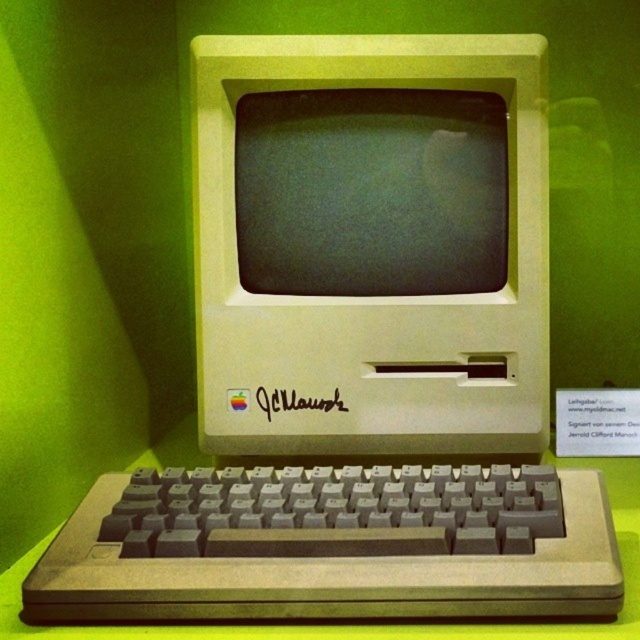
You are setting up a desk for an exhibition and need to arrange the gray plastic keyboard at lower center and the matte plastic screen at center. Which object is shorter and should be placed closer to the edge to ensure visibility?

The gray plastic keyboard at lower center is shorter than the matte plastic screen at center, so it should be placed closer to the edge to ensure visibility.

You are setting up a display for a tech exhibition and need to arrange the gray plastic keyboard at lower center and the matte plastic screen at center. According to the image, which object should be placed lower to ensure proper alignment with the vintage Apple computer?

The gray plastic keyboard at lower center should be placed lower than the matte plastic screen at center to maintain proper alignment with the vintage Apple computer.

You are an engineer inspecting the vintage Apple computer. You notice a point at coordinates (372, 243) on the image. Based on the scene description, can you identify what object this point is located on?

The point at coordinates (372, 243) is located on the beige plastic monitor at center.